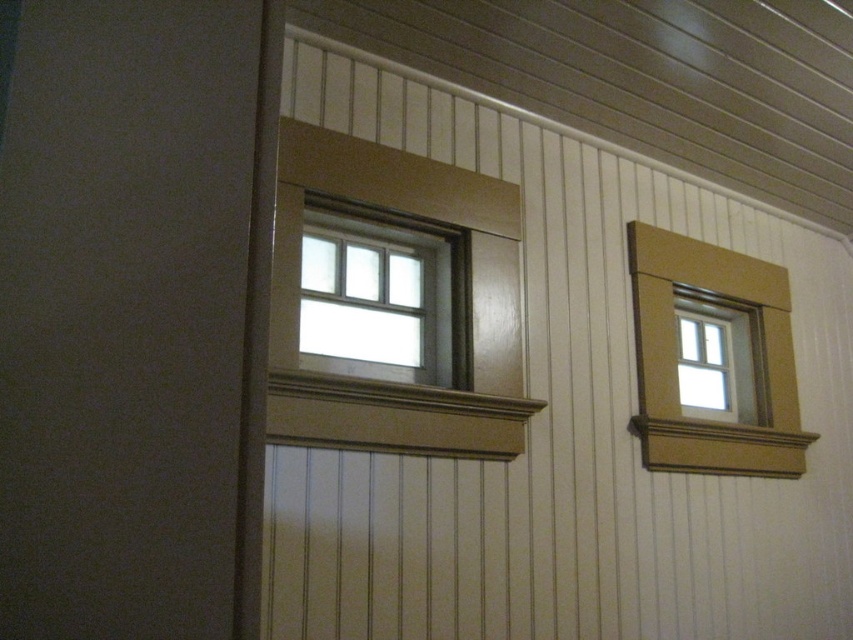
Question: Which object appears farthest from the camera in this image?

Choices:
 (A) matte wood window frame at upper right
 (B) matte brown siding at left

Answer: (A)

Question: Which of the following is the farthest from the observer?

Choices:
 (A) matte wood window frame at upper right
 (B) matte glass window at upper center
 (C) wooden siding at upper left
 (D) matte brown siding at left

Answer: (A)

Question: Observing the image, what is the correct spatial positioning of matte brown siding at left in reference to matte wood window frame at upper left?

Choices:
 (A) right
 (B) left

Answer: (B)

Question: Can you confirm if matte wood window frame at upper left is smaller than matte wood window frame at upper right?

Choices:
 (A) yes
 (B) no

Answer: (A)

Question: Which point is farther to the camera?

Choices:
 (A) (142, 348)
 (B) (602, 484)

Answer: (B)

Question: Observing the image, what is the correct spatial positioning of matte brown siding at left in reference to matte wood window frame at upper right?

Choices:
 (A) above
 (B) below

Answer: (A)